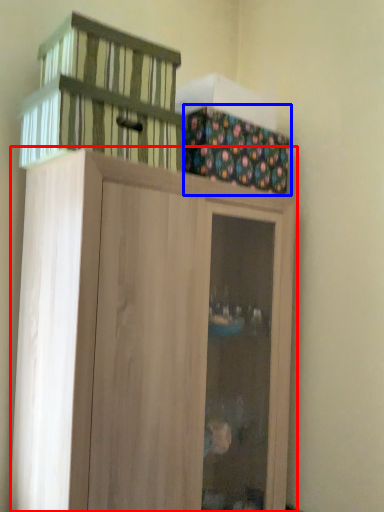
Question: Which object is closer to the camera taking this photo, cupboard (highlighted by a red box) or cabinetry (highlighted by a blue box)?

Choices:
 (A) cupboard
 (B) cabinetry

Answer: (A)